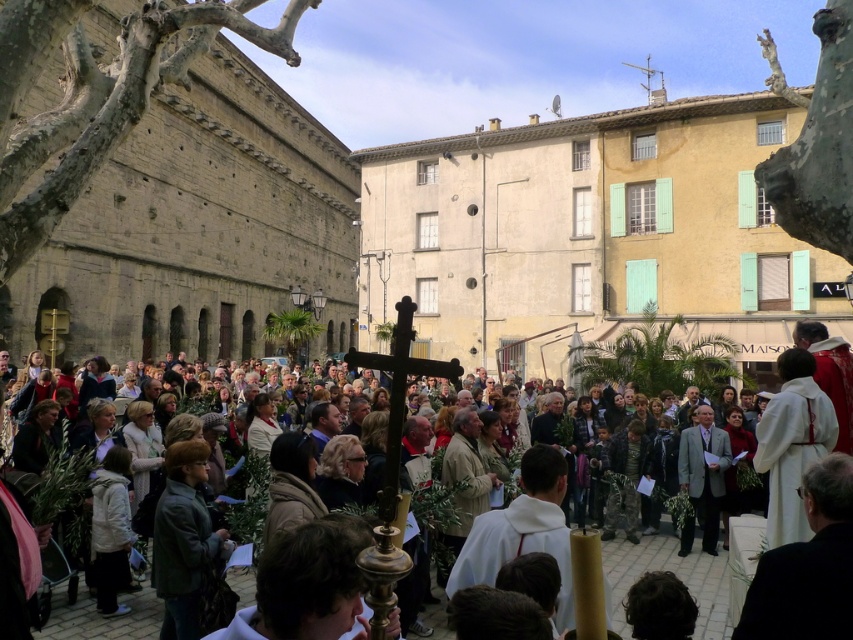
You are a photographer trying to capture a photo of the religious procession in the historic town square. You notice two individuals in the crowd wearing a dark green leather jacket at lower left and a gray wool suit at center. Based on their clothing, which person is more likely to be part of the formal procession committee? Please explain your reasoning.

The gray wool suit at center is more likely to be part of the formal procession committee because formal events often require formal attire like suits, whereas the dark green leather jacket at lower left is less formal and might belong to an attendee or observer.

You are a photographer at the event and want to capture both the dark green leather jacket at lower left and the gray wool suit at center in a single shot. Based on their positions, which one is closer to the camera?

The dark green leather jacket at lower left is located below the gray wool suit at center, meaning it is closer to the camera.

You are standing in the town square and see the point at coordinate (801,589). What object is located at that point?

The point at coordinate (801,589) corresponds to the black matte robe at lower right.